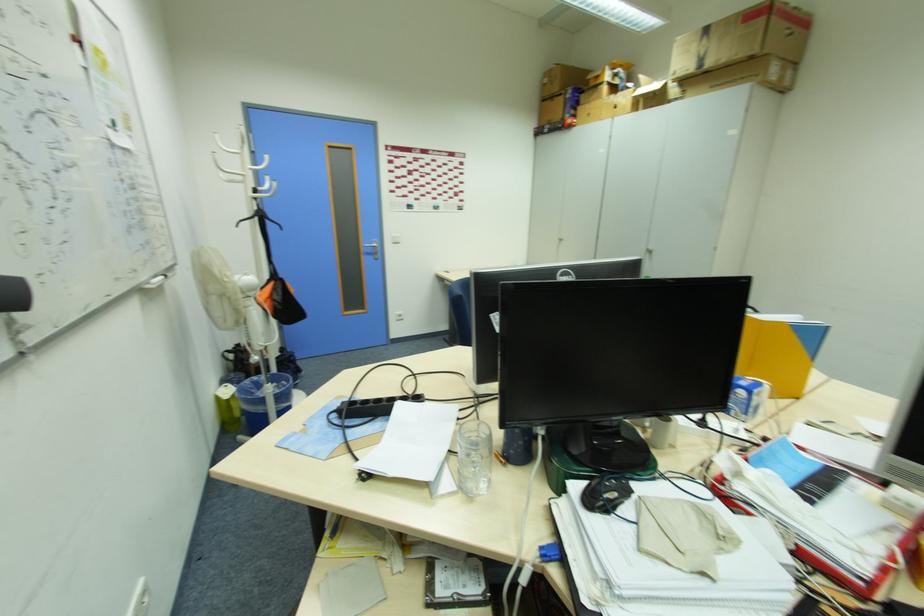
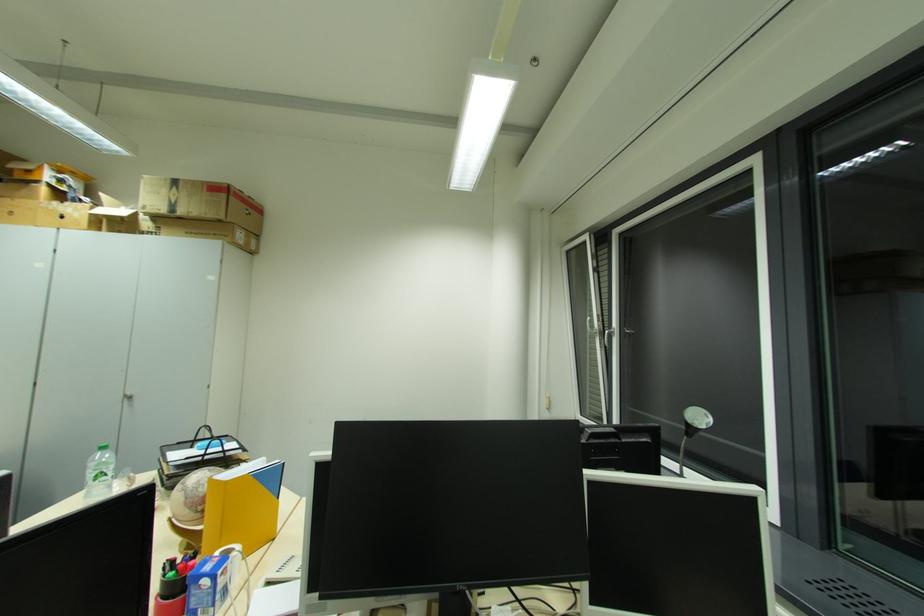
Where in the second image is the point corresponding to (759,399) from the first image?

(223, 582)